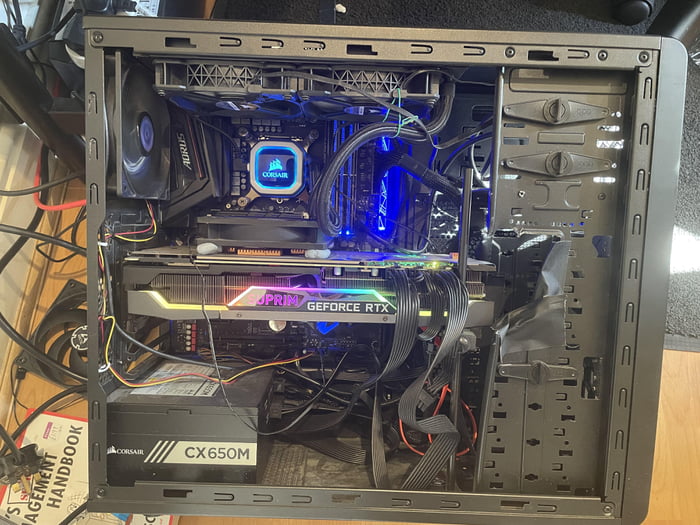
This screenshot has height=525, width=700. What are the coordinates of `book` in the screenshot? It's located at (64, 471).